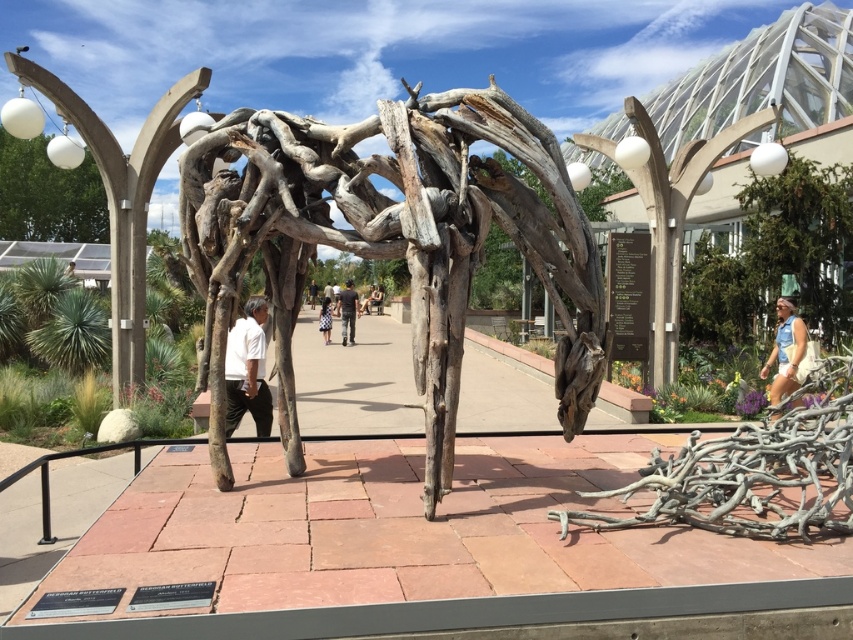
Question: Estimate the real-world distances between objects in this image. Which object is closer to the gray driftwood at lower right?

Choices:
 (A) white matte shirt at center
 (B) driftwood sculpture at center

Answer: (B)

Question: Can you confirm if white matte shirt at center is positioned to the right of denim shorts at lower right?

Choices:
 (A) no
 (B) yes

Answer: (A)

Question: Which point is farther from the camera taking this photo?

Choices:
 (A) (325, 337)
 (B) (369, 298)
 (C) (752, 432)
 (D) (405, 253)

Answer: (B)

Question: Among these points, which one is farthest from the camera?

Choices:
 (A) (230, 352)
 (B) (350, 294)

Answer: (B)

Question: Does driftwood sculpture at center come behind gray driftwood at lower right?

Choices:
 (A) no
 (B) yes

Answer: (B)

Question: Does white matte shirt at center have a larger size compared to white cotton shirt at center?

Choices:
 (A) no
 (B) yes

Answer: (A)